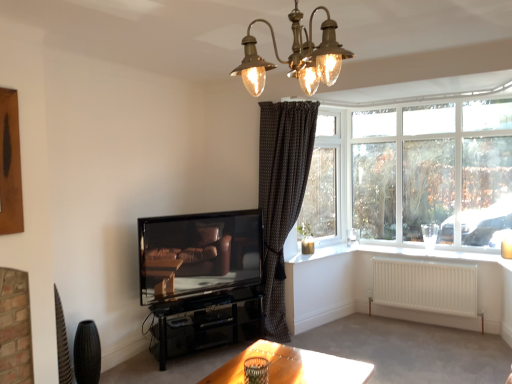
Question: Relative to white painted wood at lower right, is black textured curtain at upper right in front or behind?

Choices:
 (A) front
 (B) behind

Answer: (B)

Question: From a real-world perspective, is black textured curtain at upper right positioned above or below white painted wood at lower right?

Choices:
 (A) below
 (B) above

Answer: (B)

Question: Estimate the real-world distances between objects in this image. Which object is farther from the black textured curtain at upper right?

Choices:
 (A) brown dotted fabric curtain at center
 (B) matte black television at center
 (C) brass textured chandelier at upper center
 (D) white painted wood at lower right
 (E) white matte radiator at lower right

Answer: (C)

Question: Considering the real-world distances, which object is closest to the matte black television at center?

Choices:
 (A) white matte radiator at lower right
 (B) brown dotted fabric curtain at center
 (C) white glass window at upper right
 (D) brass textured chandelier at upper center
 (E) white painted wood at lower right

Answer: (B)